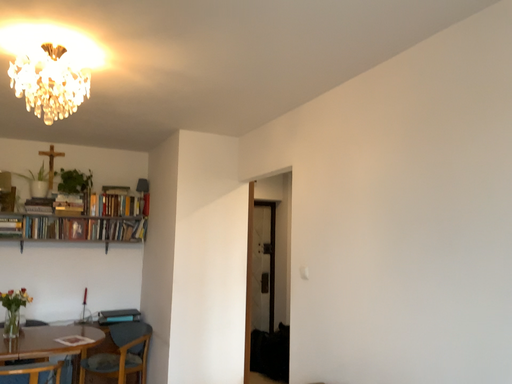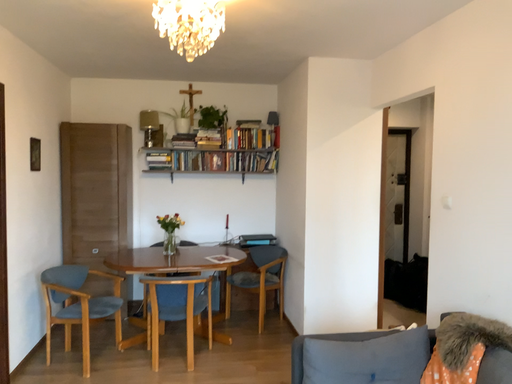
Question: Which way did the camera rotate in the video?

Choices:
 (A) rotated downward
 (B) rotated upward

Answer: (A)